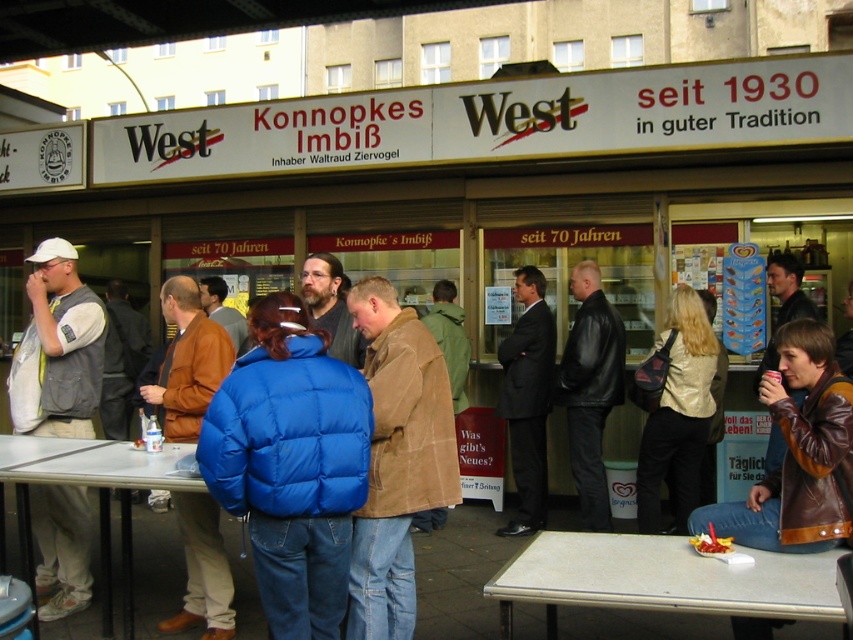
You are a customer at the street food stall and want to place your order. You have a plate that is the same size as the smooth plastic chips at center. Can you fit the plate on the white laminate table at lower right?

The white laminate table at lower right is wider than the smooth plastic chips at center, so yes, the plate will fit on the white laminate table at lower right.

What is the position of the white laminate table at lower right relative to the shiny gold jacket at center?

The white laminate table at lower right is located to the left of the shiny gold jacket at center.

You are a customer standing at the entrance of the Konnopkes Imbi? West food stall. You need to place your order at the white laminate table at lower right and then retrieve your jacket, the shiny gold jacket at center. Can you walk directly from the table to the jacket without moving any other objects?

The distance between the white laminate table at lower right and the shiny gold jacket at center is 8.76 feet, so yes, you can walk directly from the table to the jacket without moving any other objects as there is sufficient space.